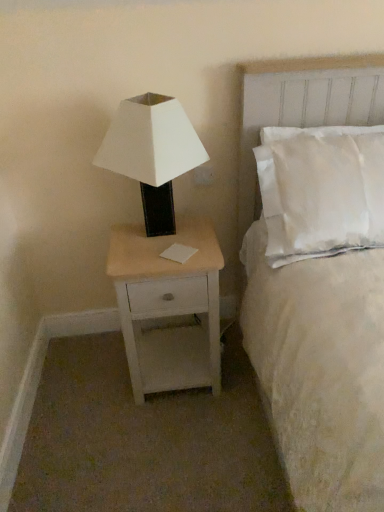
Where is `free region on the left part of light wood/white painted nightstand at lower left`? free region on the left part of light wood/white painted nightstand at lower left is located at coordinates (95, 381).